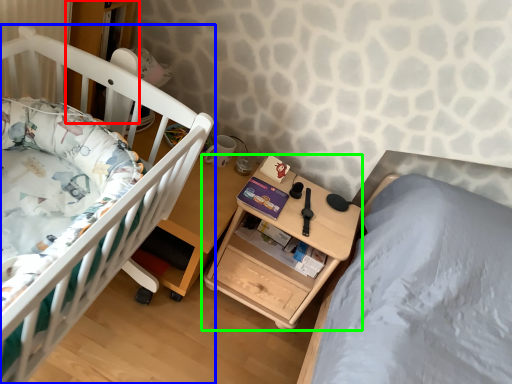
Question: Which is farther away from bookshelf (highlighted by a red box)? infant bed (highlighted by a blue box) or nightstand (highlighted by a green box)?

Choices:
 (A) infant bed
 (B) nightstand

Answer: (B)